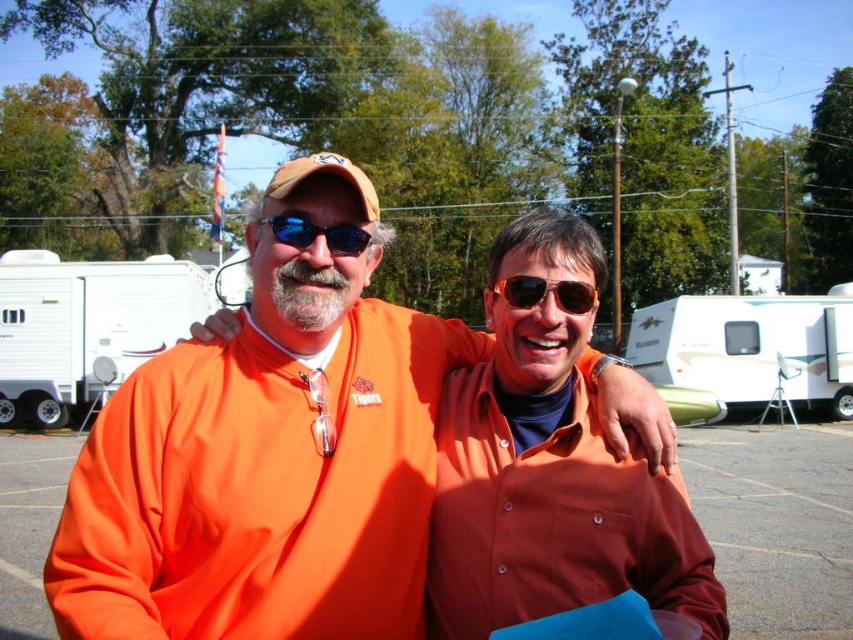
You are planning to take a photo of the white glossy trailer at right and the gold reflective sunglasses at center. Which object should you focus on first if you want to ensure both are in focus, considering their size differences?

The white glossy trailer at right is much taller than the gold reflective sunglasses at center, so you should focus on the white glossy trailer at right first to ensure both are in focus.

You are a photographer standing at the center of the parking lot. You have a camera with a 100mm lens that can focus on objects up to 20 meters away. You want to take a photo of the white glossy trailer at right while also including the blue reflective sunglasses at center in the frame. Will both objects be in focus if you focus on the trailer?

The white glossy trailer at right is 18.19 meters away from the blue reflective sunglasses at center. Since the trailer is within the 20 meter range of the 100mm lens, both objects will be in focus when focusing on the trailer.

You are planning to take a photo of the white plastic trailer at left and the gold reflective sunglasses at center. To ensure both are fully visible in the frame, should you adjust your camera to a wider angle or a narrower angle?

The white plastic trailer at left might be wider than gold reflective sunglasses at center, so you should adjust your camera to a wider angle to ensure both are fully visible in the frame.